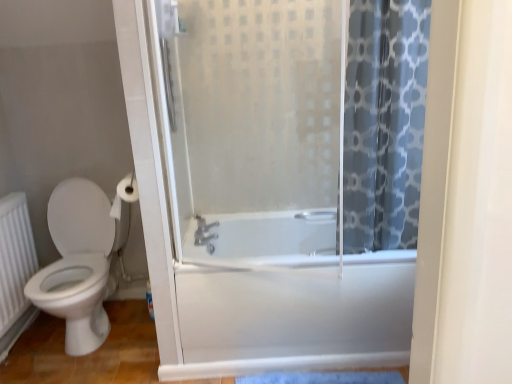
Question: Can you confirm if blue printed fabric at right is thinner than white glossy toilet at left?

Choices:
 (A) no
 (B) yes

Answer: (B)

Question: Is blue printed fabric at right taller than white glossy toilet at left?

Choices:
 (A) no
 (B) yes

Answer: (B)

Question: From a real-world perspective, is blue printed fabric at right below white glossy toilet at left?

Choices:
 (A) yes
 (B) no

Answer: (B)

Question: Is blue printed fabric at right outside white glossy toilet at left?

Choices:
 (A) no
 (B) yes

Answer: (B)

Question: From the image's perspective, is blue printed fabric at right below white glossy toilet at left?

Choices:
 (A) yes
 (B) no

Answer: (B)

Question: Is blue printed fabric at right looking in the opposite direction of white glossy toilet at left?

Choices:
 (A) yes
 (B) no

Answer: (B)

Question: Is satin nickel faucet at center further to camera compared to white textured radiator at lower left?

Choices:
 (A) no
 (B) yes

Answer: (B)

Question: Is satin nickel faucet at center touching white textured radiator at lower left?

Choices:
 (A) no
 (B) yes

Answer: (A)

Question: Considering the relative positions of satin nickel faucet at center and white textured radiator at lower left in the image provided, is satin nickel faucet at center to the right of white textured radiator at lower left from the viewer's perspective?

Choices:
 (A) yes
 (B) no

Answer: (A)

Question: From the image's perspective, does satin nickel faucet at center appear lower than white textured radiator at lower left?

Choices:
 (A) yes
 (B) no

Answer: (B)

Question: Can you confirm if satin nickel faucet at center is thinner than white textured radiator at lower left?

Choices:
 (A) no
 (B) yes

Answer: (A)

Question: Can you confirm if satin nickel faucet at center is positioned to the left of white textured radiator at lower left?

Choices:
 (A) no
 (B) yes

Answer: (A)

Question: From a real-world perspective, does white matte toilet paper at upper left stand above blue printed fabric at right?

Choices:
 (A) no
 (B) yes

Answer: (A)